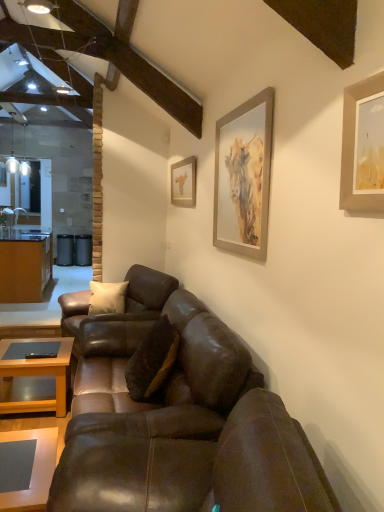
Question: From the image's perspective, is matte gold picture frame at upper center, arranged as the first picture frame when viewed from the back, below brown suede pillow at center?

Choices:
 (A) no
 (B) yes

Answer: (A)

Question: Can you confirm if matte gold picture frame at upper center, positioned as the 1th picture frame in left-to-right order, is thinner than brown suede pillow at center?

Choices:
 (A) no
 (B) yes

Answer: (B)

Question: Considering the relative positions of matte gold picture frame at upper center, acting as the second picture frame starting from the right, and brown suede pillow at center in the image provided, is matte gold picture frame at upper center, acting as the second picture frame starting from the right, to the right of brown suede pillow at center from the viewer's perspective?

Choices:
 (A) no
 (B) yes

Answer: (B)

Question: Are matte gold picture frame at upper center, arranged as the first picture frame when viewed from the back, and brown suede pillow at center located far from each other?

Choices:
 (A) no
 (B) yes

Answer: (B)

Question: From the image's perspective, is matte gold picture frame at upper center, positioned as the 1th picture frame in left-to-right order, on top of brown suede pillow at center?

Choices:
 (A) yes
 (B) no

Answer: (A)

Question: In terms of width, does brown suede pillow at center look wider or thinner when compared to brown leather couch at center, acting as the second studio couch starting from the front?

Choices:
 (A) wide
 (B) thin

Answer: (B)

Question: Is point (168, 368) positioned closer to the camera than point (182, 336)?

Choices:
 (A) closer
 (B) farther

Answer: (B)

Question: Considering the relative positions of brown suede pillow at center and brown leather couch at center, acting as the second studio couch starting from the front, in the image provided, is brown suede pillow at center to the left or to the right of brown leather couch at center, acting as the second studio couch starting from the front,?

Choices:
 (A) left
 (B) right

Answer: (B)

Question: Relative to brown leather couch at center, acting as the second studio couch starting from the front, is brown suede pillow at center in front or behind?

Choices:
 (A) behind
 (B) front

Answer: (A)

Question: Would you say matte gray coffee table at lower left, the 1th coffee table in the right-to-left sequence, is inside or outside brown leather couch at center, acting as the second studio couch starting from the front?

Choices:
 (A) outside
 (B) inside

Answer: (A)

Question: From the image's perspective, is matte gray coffee table at lower left, the 1th coffee table positioned from the front, located above or below brown leather couch at center, acting as the 2th studio couch starting from the back?

Choices:
 (A) above
 (B) below

Answer: (B)

Question: Is matte gray coffee table at lower left, the 1th coffee table in the right-to-left sequence, taller or shorter than brown leather couch at center, acting as the second studio couch starting from the front?

Choices:
 (A) short
 (B) tall

Answer: (A)

Question: In terms of size, does matte gray coffee table at lower left, the 2th coffee table from the back, appear bigger or smaller than brown leather couch at center, acting as the 2th studio couch starting from the back?

Choices:
 (A) small
 (B) big

Answer: (A)

Question: From the image's perspective, is brown leather couch at center, acting as the second studio couch starting from the front, above or below silver metallic picture frame at upper right, which is counted as the 2th picture frame, starting from the back?

Choices:
 (A) below
 (B) above

Answer: (A)

Question: Looking at their shapes, would you say brown leather couch at center, acting as the second studio couch starting from the front, is wider or thinner than silver metallic picture frame at upper right, which is counted as the 2th picture frame, starting from the back?

Choices:
 (A) wide
 (B) thin

Answer: (A)